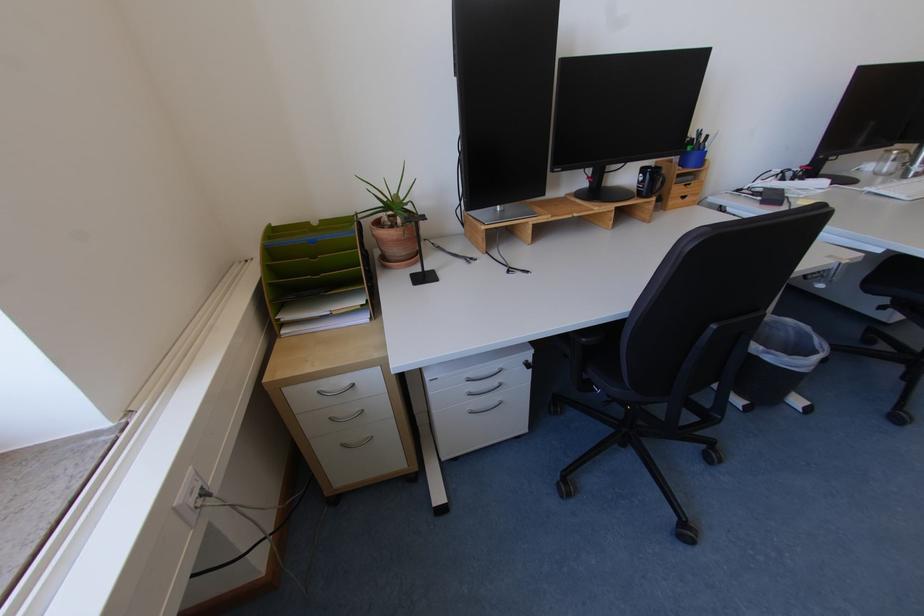
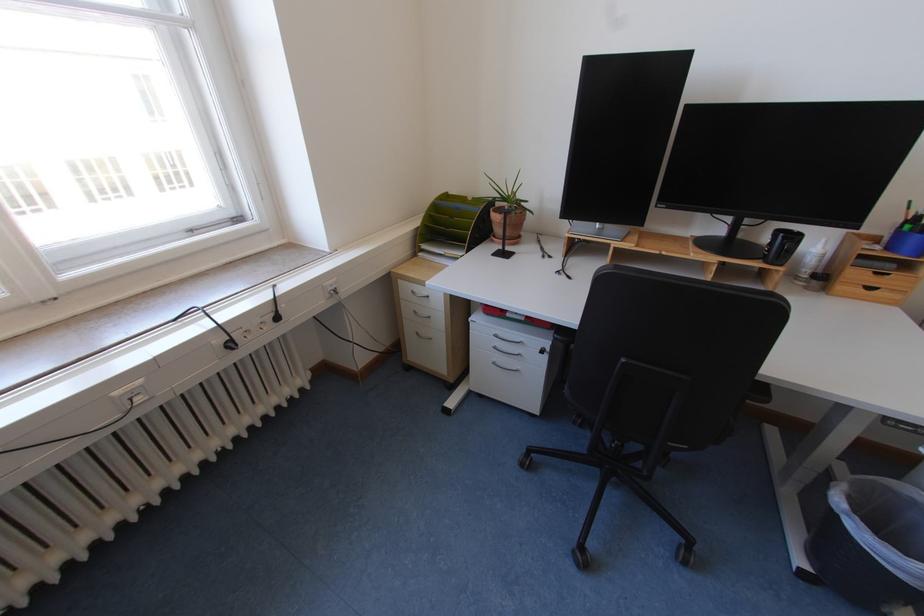
Locate, in the second image, the point that corresponds to point (678, 198) in the first image.

(848, 281)